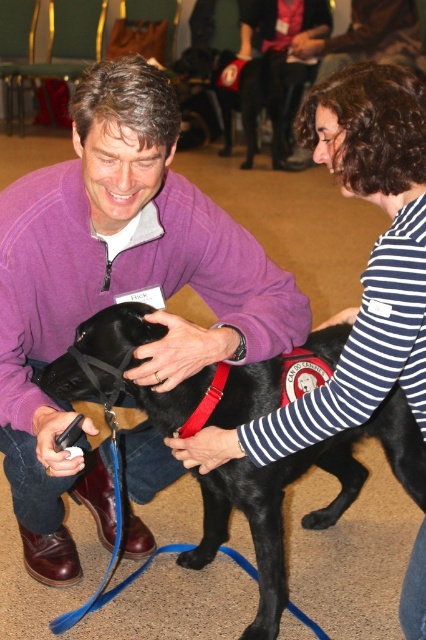
Question: From the image, what is the correct spatial relationship of striped cotton shirt at center in relation to shiny black dog at center?

Choices:
 (A) right
 (B) left

Answer: (A)

Question: Observing the image, what is the correct spatial positioning of purple fleece sweater at center in reference to striped cotton shirt at center?

Choices:
 (A) above
 (B) below

Answer: (B)

Question: Which of these objects is positioned closest to the purple fleece sweater at center?

Choices:
 (A) striped cotton shirt at center
 (B) shiny black dog at center

Answer: (B)

Question: Among these objects, which one is nearest to the camera?

Choices:
 (A) striped cotton shirt at center
 (B) shiny black dog at center

Answer: (A)

Question: Can you confirm if striped cotton shirt at center is smaller than shiny black dog at center?

Choices:
 (A) yes
 (B) no

Answer: (A)

Question: Which of the following is the closest to the observer?

Choices:
 (A) shiny black dog at center
 (B) striped cotton shirt at center
 (C) purple fleece sweater at center

Answer: (B)